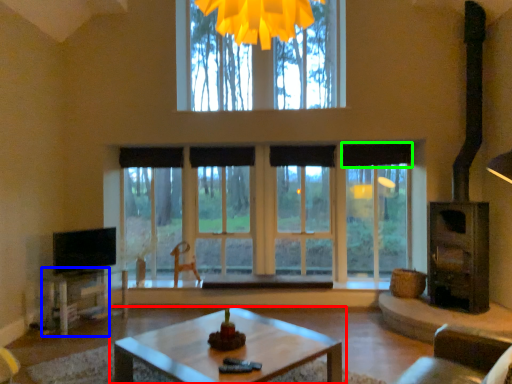
Question: Estimate the real-world distances between objects in this image. Which object is closer to coffee table (highlighted by a red box), table (highlighted by a blue box) or curtain (highlighted by a green box)?

Choices:
 (A) table
 (B) curtain

Answer: (A)